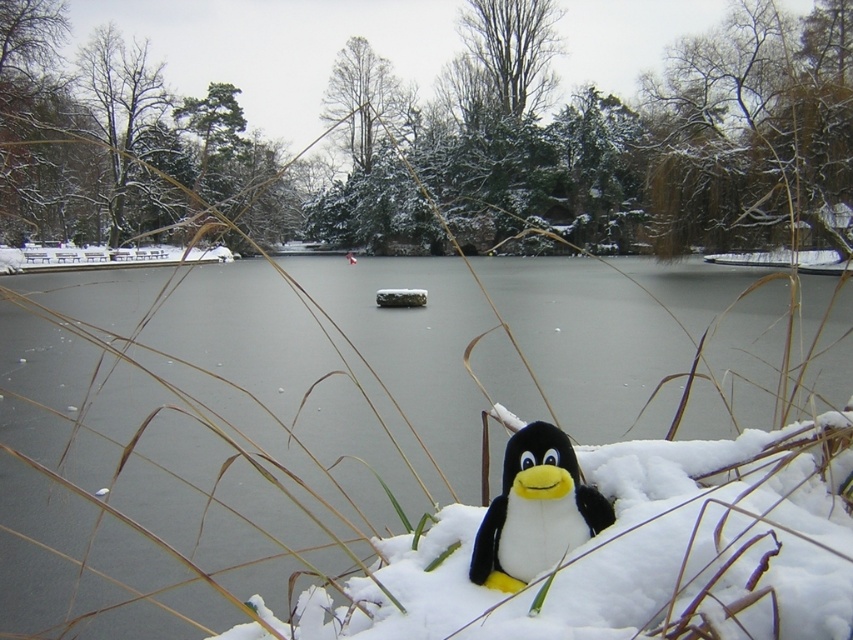
Question: Which of the following is the closest to the observer?

Choices:
 (A) black plush penguin at lower center
 (B) frozen water at center
 (C) white fluffy snow at center

Answer: (C)

Question: Does white fluffy snow at center have a larger size compared to frozen water at center?

Choices:
 (A) yes
 (B) no

Answer: (B)

Question: Which point appears farthest from the camera in this image?

Choices:
 (A) (427, 564)
 (B) (282, 333)

Answer: (B)

Question: Does black plush penguin at lower center appear under frozen water at center?

Choices:
 (A) yes
 (B) no

Answer: (A)

Question: Which point is farther to the camera?

Choices:
 (A) (606, 307)
 (B) (643, 547)

Answer: (A)

Question: Is black plush penguin at lower center closer to camera compared to frozen water at center?

Choices:
 (A) no
 (B) yes

Answer: (B)